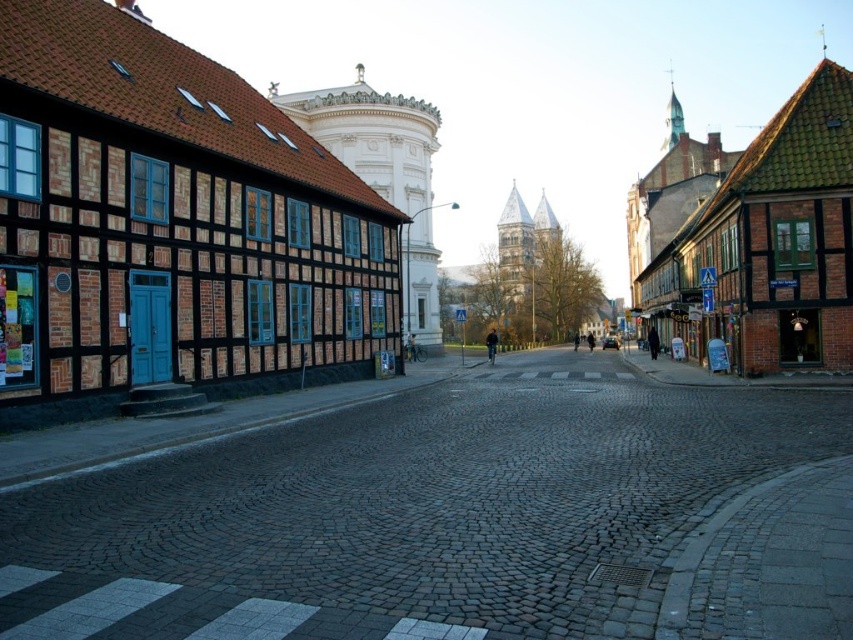
Can you confirm if matte brick building at left is taller than brown wooden building at left?

No.

The height and width of the screenshot is (640, 853). I want to click on matte brick building at left, so click(x=170, y=227).

Is brown wooden building at left to the right of brown wooden house at right from the viewer's perspective?

In fact, brown wooden building at left is to the left of brown wooden house at right.

Who is taller, brown wooden building at left or brown wooden house at right?

brown wooden building at left is taller.

Who is more forward, (230,189) or (819,189)?

Point (230,189) is in front.

Where is `brown wooden building at left`? brown wooden building at left is located at coordinates (172, 225).

Is point (163, 234) positioned after point (822, 118)?

No.

Does matte brick building at left have a lesser width compared to brown wooden house at right?

Yes.

Find the location of `matte brick building at left`. matte brick building at left is located at coordinates (170, 227).